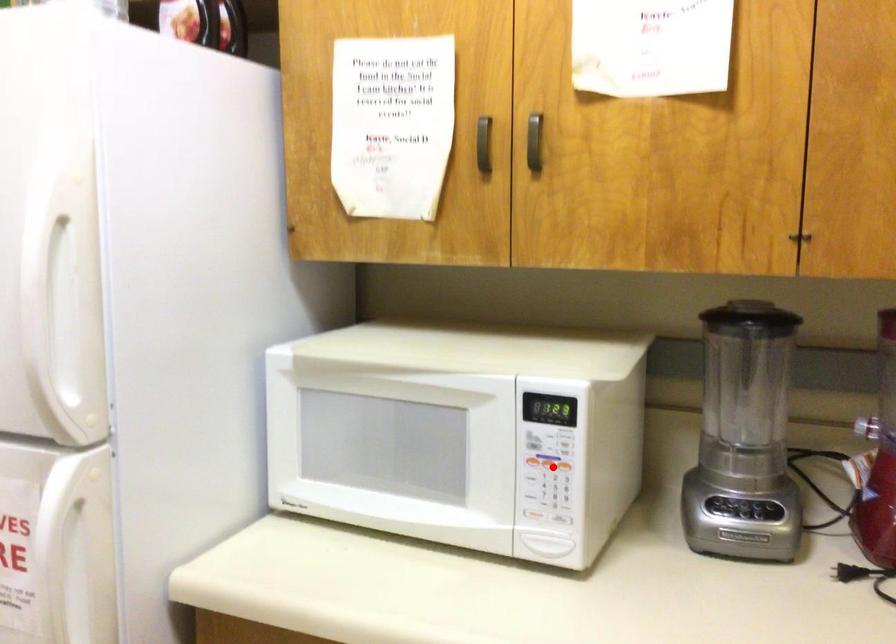
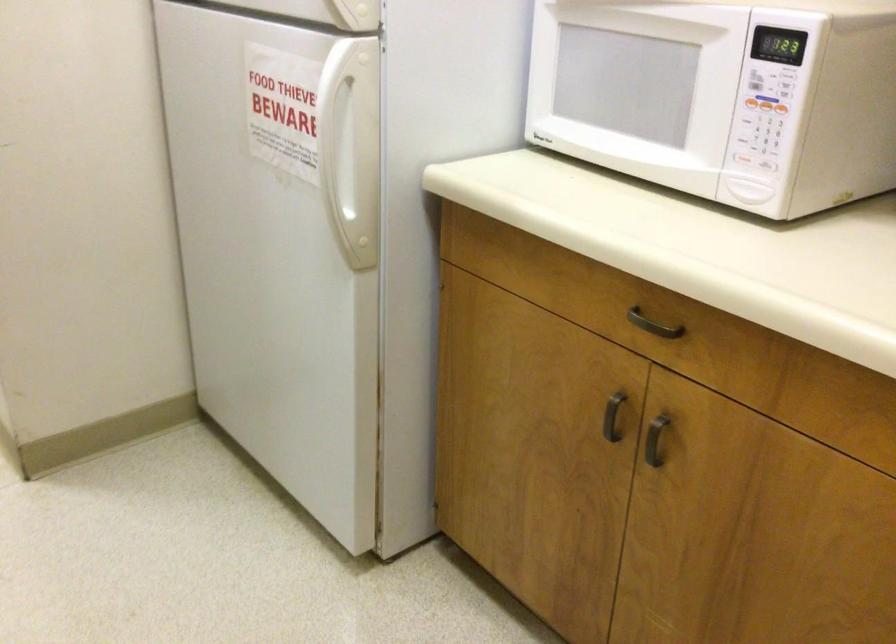
In the second image, find the point that corresponds to the highlighted location in the first image.

(765, 104)